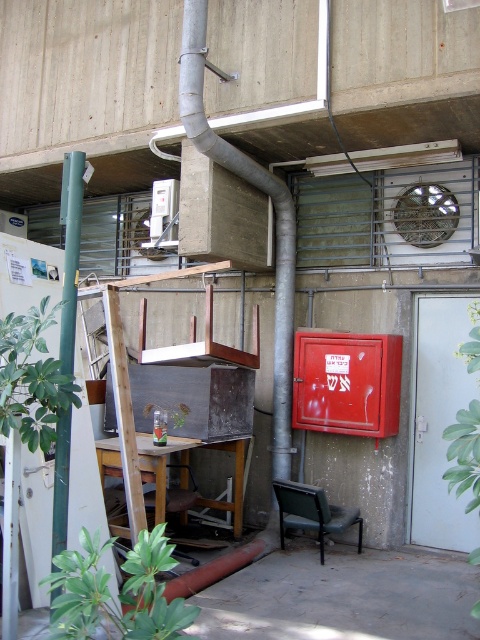
Question: Is silver metallic pipe at upper center above green fabric chair at lower center?

Choices:
 (A) no
 (B) yes

Answer: (B)

Question: Does silver metallic pipe at upper center come in front of green matte pole at left?

Choices:
 (A) yes
 (B) no

Answer: (B)

Question: Which is farther from the green fabric chair at lower center?

Choices:
 (A) green matte pole at left
 (B) silver metallic pipe at upper center

Answer: (A)

Question: Which point is closer to the camera?

Choices:
 (A) (61, 536)
 (B) (322, 552)
 (C) (268, 182)

Answer: (A)

Question: Is silver metallic pipe at upper center to the right of green matte pole at left from the viewer's perspective?

Choices:
 (A) yes
 (B) no

Answer: (A)

Question: Which of these objects is positioned closest to the silver metallic pipe at upper center?

Choices:
 (A) green fabric chair at lower center
 (B) green matte pole at left

Answer: (A)